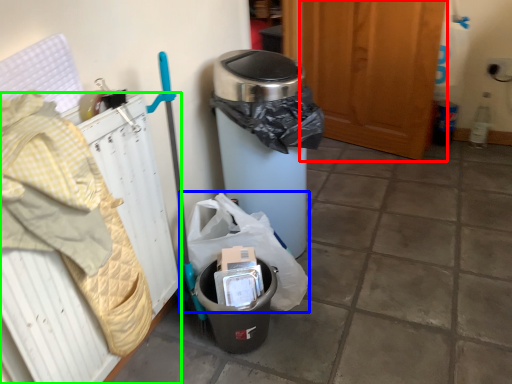
Question: Which object is the farthest from screen door (highlighted by a red box)? Choose among these: garbage (highlighted by a blue box) or radiator (highlighted by a green box).

Choices:
 (A) garbage
 (B) radiator

Answer: (B)